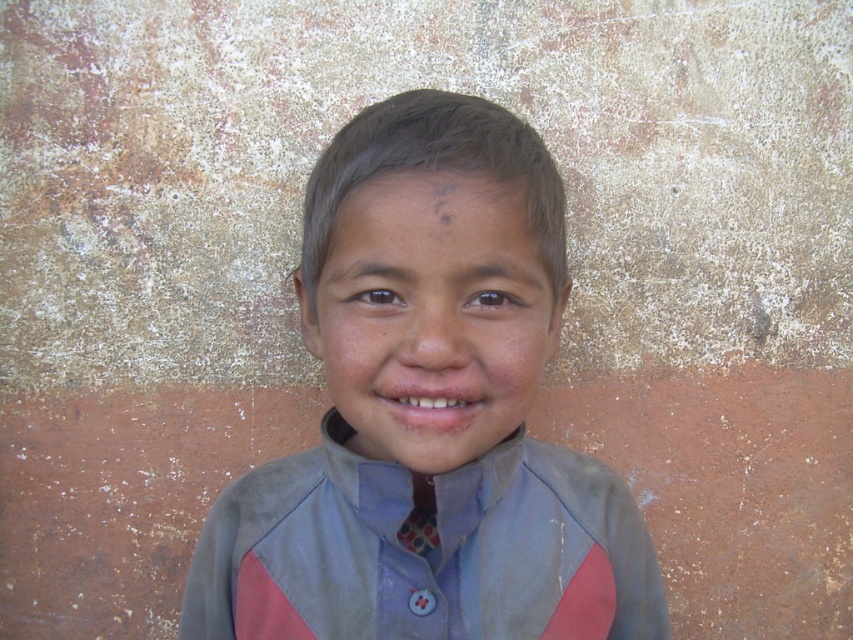
Question: Is matte gray shirt at center further to the viewer compared to smooth skin mouth at center?

Choices:
 (A) yes
 (B) no

Answer: (B)

Question: Which object is positioned farthest from the smooth skin face at center?

Choices:
 (A) matte gray shirt at center
 (B) gray cotton jacket at center

Answer: (B)

Question: Which point is closer to the camera?

Choices:
 (A) (373, 472)
 (B) (486, 356)
 (C) (425, 518)
 (D) (519, 390)

Answer: (B)

Question: Is matte gray shirt at center below plaid fabric tie at center?

Choices:
 (A) yes
 (B) no

Answer: (B)

Question: Does smooth skin face at center appear over plaid fabric tie at center?

Choices:
 (A) no
 (B) yes

Answer: (B)

Question: Which of the following is the closest to the observer?

Choices:
 (A) (367, 244)
 (B) (260, 561)

Answer: (A)